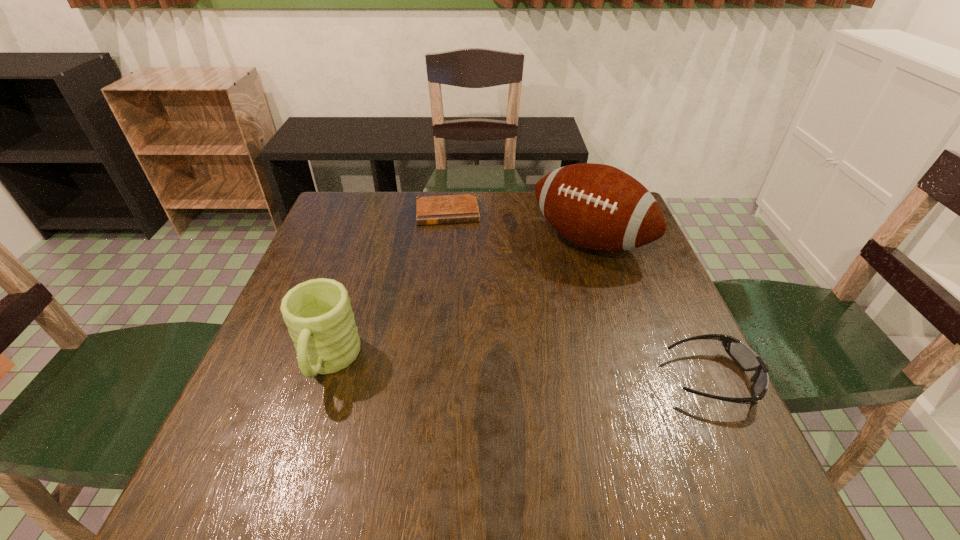
Image resolution: width=960 pixels, height=540 pixels. Find the location of `free spot between the second tallest object and the second shortest object`. free spot between the second tallest object and the second shortest object is located at coordinates (520, 370).

You are a GUI agent. You are given a task and a screenshot of the screen. Output one action in this format:
    pyautogui.click(x=<x>, y=<y>)
    Task: Click on the vacant point located between the shortest object and the sunglasses
    The width and height of the screenshot is (960, 540).
    Given the screenshot: What is the action you would take?
    pyautogui.click(x=580, y=295)

At what (x,y) coordinates should I click in order to perform the action: click on unoccupied area between the mug and the shortest object. Please return your answer as a coordinate pair (x, y). The height and width of the screenshot is (540, 960). Looking at the image, I should click on (388, 287).

Where is `free point between the second shortest object and the shortest object`? The height and width of the screenshot is (540, 960). free point between the second shortest object and the shortest object is located at coordinates [580, 295].

You are a GUI agent. You are given a task and a screenshot of the screen. Output one action in this format:
    pyautogui.click(x=<x>, y=<y>)
    Task: Click on the free space between the tallest object and the shortest object
    
    Given the screenshot: What is the action you would take?
    pyautogui.click(x=518, y=227)

I want to click on vacant space in between the tallest object and the shortest object, so click(x=518, y=227).

The image size is (960, 540). What are the coordinates of `the second closest object to the shortest object` in the screenshot? It's located at (317, 312).

This screenshot has width=960, height=540. What are the coordinates of `object that is the third closest to the tallest object` in the screenshot? It's located at (317, 312).

The width and height of the screenshot is (960, 540). I want to click on free space that satisfies the following two spatial constraints: 1. on the side of the sunglasses with the handle; 2. on the lenses of the mug, so point(323,379).

Identify the location of vacant space that satisfies the following two spatial constraints: 1. on the front side of the third object from right to left; 2. on the lenses of the third tallest object. Image resolution: width=960 pixels, height=540 pixels. (431, 379).